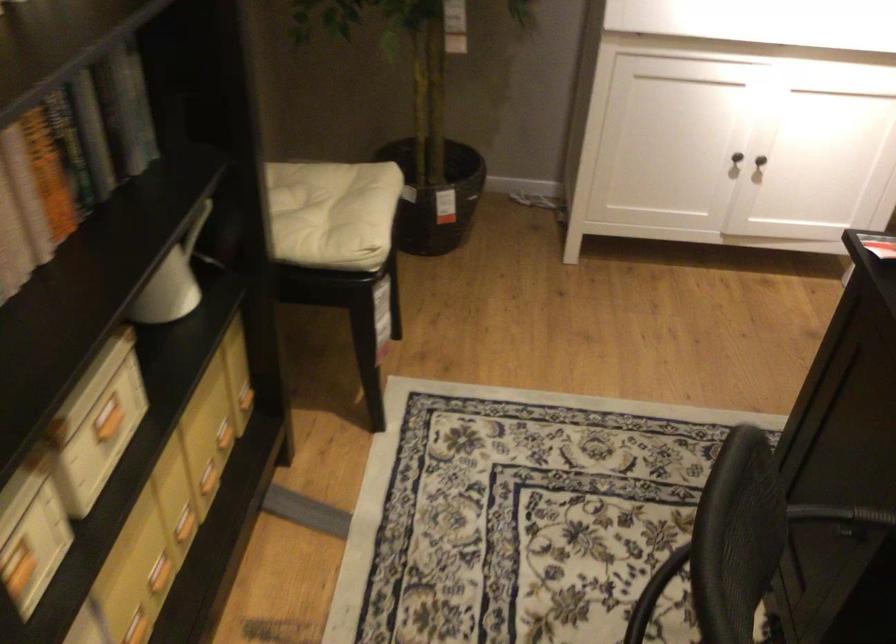
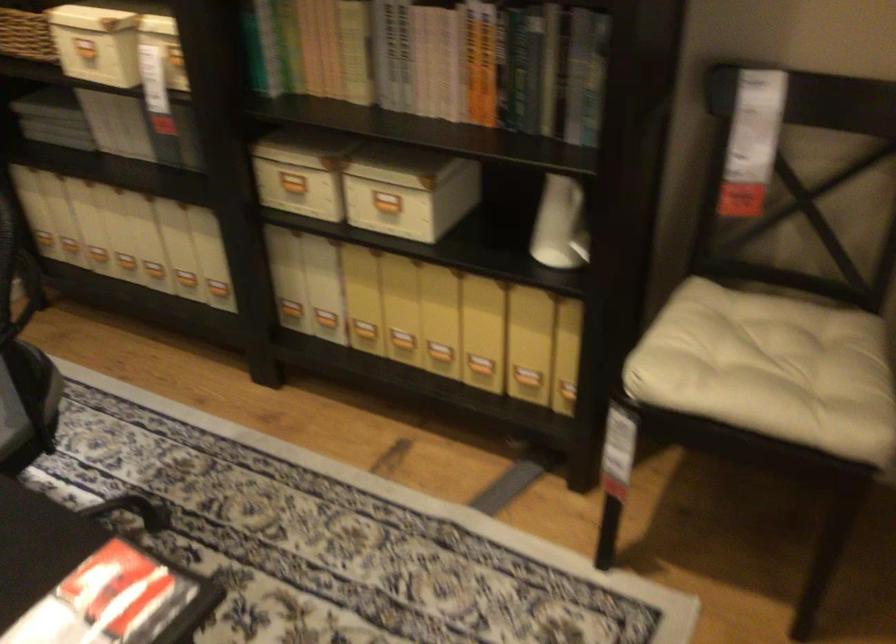
Locate, in the second image, the point that corresponds to [181,279] in the first image.

(582, 238)